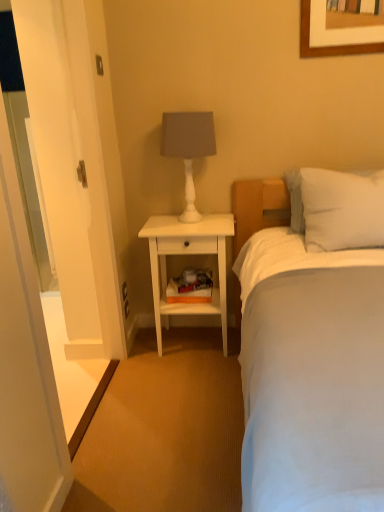
Question: From their relative heights in the image, would you say white wood nightstand at center is taller or shorter than white glossy door at left?

Choices:
 (A) tall
 (B) short

Answer: (B)

Question: From a real-world perspective, is white wood nightstand at center above or below white glossy door at left?

Choices:
 (A) above
 (B) below

Answer: (B)

Question: Which object is positioned farthest from the white soft bed at center?

Choices:
 (A) white soft pillow at upper right
 (B) white wood nightstand at center
 (C) white matte table lamp at upper center
 (D) white glossy door at left

Answer: (D)

Question: Which of these objects is positioned farthest from the white matte table lamp at upper center?

Choices:
 (A) white soft bed at center
 (B) white wood nightstand at center
 (C) white glossy door at left
 (D) white soft pillow at upper right

Answer: (A)